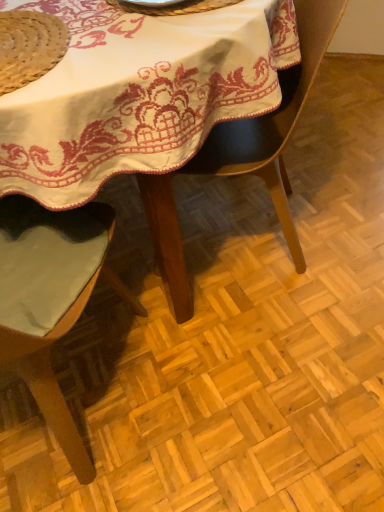
Where is `free space in front of black leather chair at center, the first chair viewed from the right`? free space in front of black leather chair at center, the first chair viewed from the right is located at coordinates (261, 345).